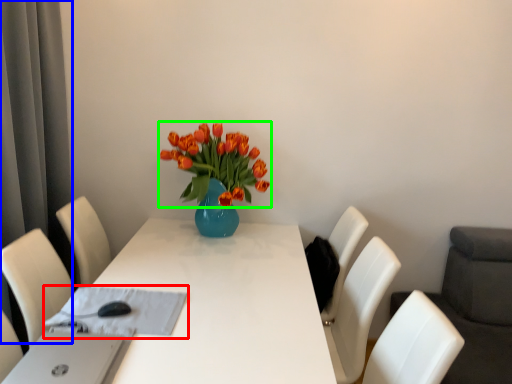
Question: Which object is positioned farthest from cloth (highlighted by a red box)? Select from curtain (highlighted by a blue box) and flower (highlighted by a green box).

Choices:
 (A) curtain
 (B) flower

Answer: (A)